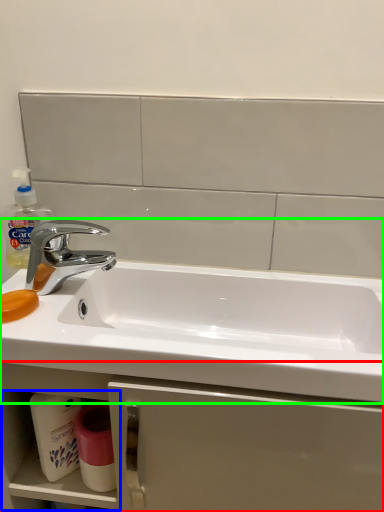
Question: Estimate the real-world distances between objects in this image. Which object is closer to bathroom cabinet (highlighted by a red box), shelf (highlighted by a blue box) or sink (highlighted by a green box)?

Choices:
 (A) shelf
 (B) sink

Answer: (A)